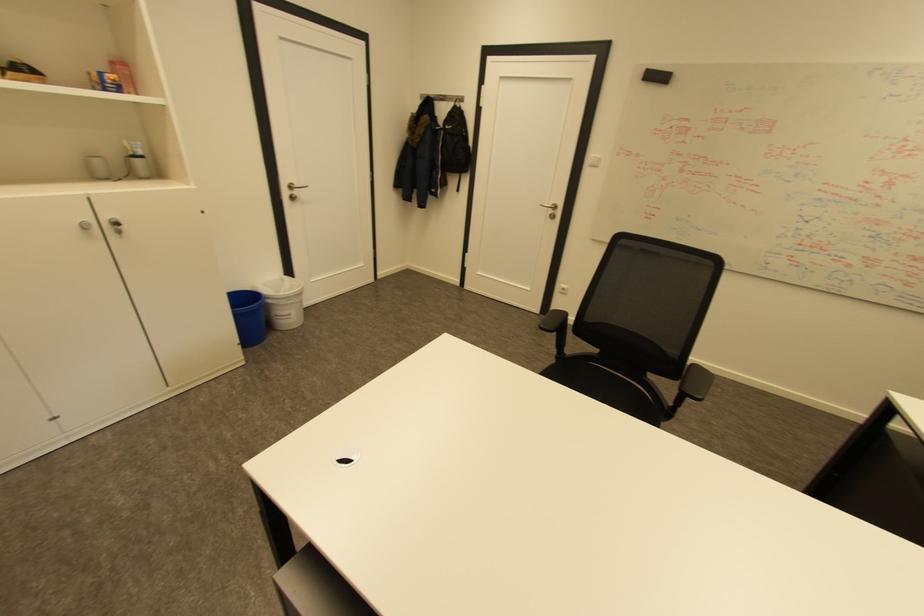
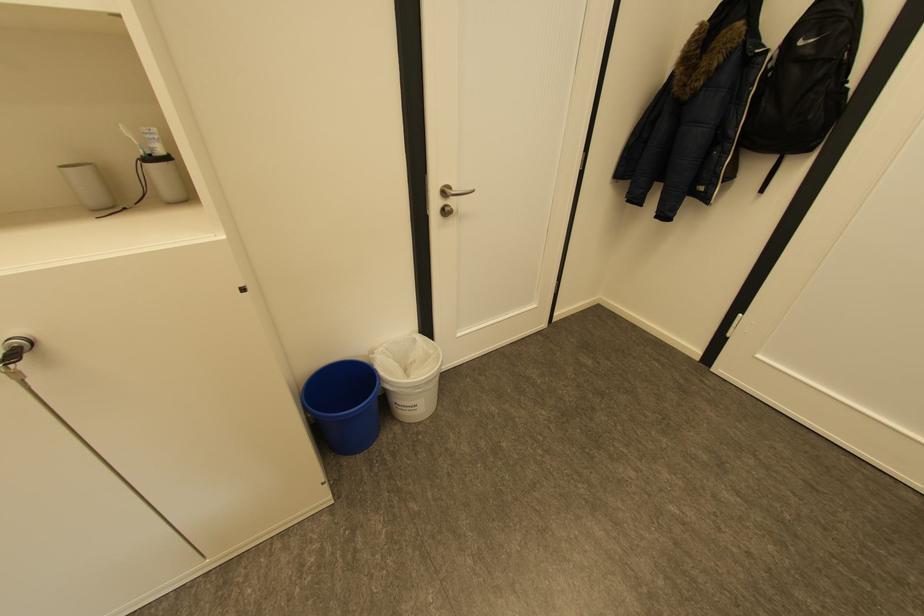
In the second image, find the point that corresponds to [140,154] in the first image.

(150, 153)